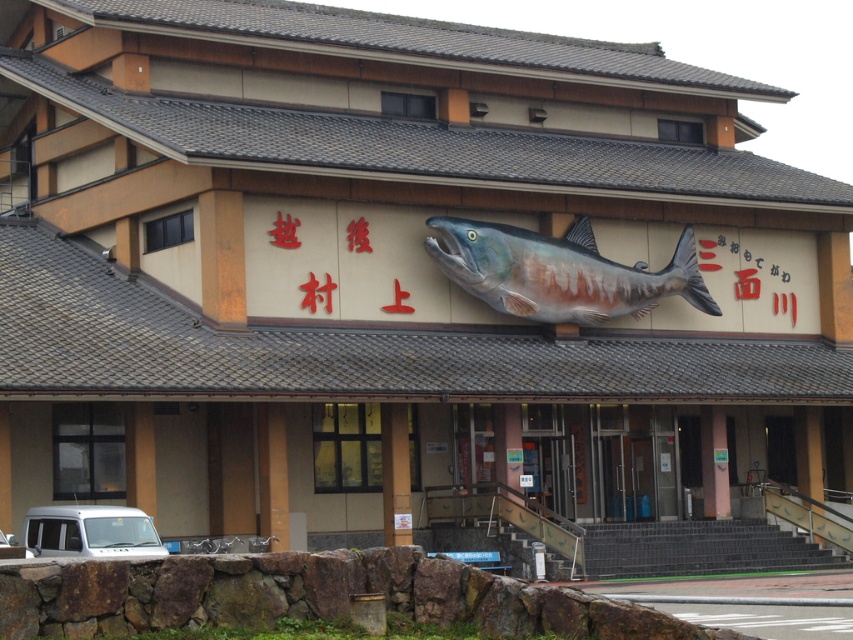
Question: In this image, where is silver metallic van at lower left located relative to white matte van at lower left?

Choices:
 (A) above
 (B) below

Answer: (B)

Question: Which is farther from the white matte van at lower left?

Choices:
 (A) silver metallic van at lower left
 (B) shiny metallic fish at center

Answer: (B)

Question: Among these objects, which one is nearest to the camera?

Choices:
 (A) silver metallic van at lower left
 (B) white matte van at lower left

Answer: (B)

Question: Does shiny metallic fish at center appear under white matte van at lower left?

Choices:
 (A) yes
 (B) no

Answer: (B)

Question: Which point is farther to the camera?

Choices:
 (A) shiny metallic fish at center
 (B) silver metallic van at lower left
 (C) white matte van at lower left

Answer: (A)

Question: Where is shiny metallic fish at center located in relation to silver metallic van at lower left in the image?

Choices:
 (A) above
 (B) below

Answer: (A)